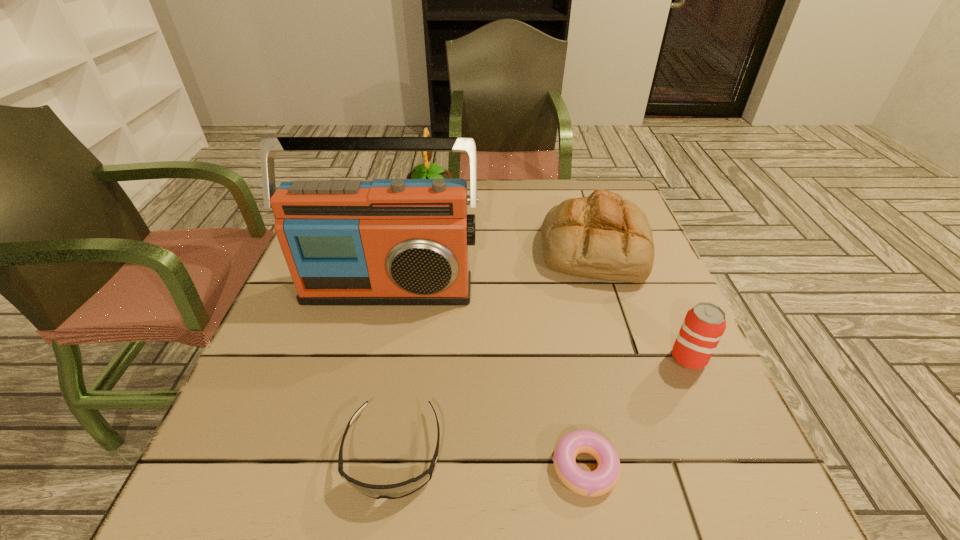
In the image, there is a desktop. At what (x,y) coordinates should I click in order to perform the action: click on vacant space at the far edge. Please return your answer as a coordinate pair (x, y). Looking at the image, I should click on (539, 200).

In the image, there is a desktop. Where is `vacant region at the near edge`? The width and height of the screenshot is (960, 540). vacant region at the near edge is located at coordinates (365, 478).

Identify the location of vacant space at the left edge. (255, 358).

Locate an element on the screen. This screenshot has width=960, height=540. free space at the right edge of the desktop is located at coordinates (675, 397).

Where is `free space between the goggles and the bread`? free space between the goggles and the bread is located at coordinates (494, 350).

Locate an element on the screen. The image size is (960, 540). blank region between the bread and the tallest object is located at coordinates (492, 268).

The height and width of the screenshot is (540, 960). What are the coordinates of `vacant point located between the second shortest object and the doughnut` in the screenshot? It's located at (489, 460).

The image size is (960, 540). Identify the location of vacant area that lies between the shortest object and the sunflower. (507, 330).

Where is `vacant point located between the shortest object and the farthest object`? vacant point located between the shortest object and the farthest object is located at coordinates (507, 330).

The width and height of the screenshot is (960, 540). What are the coordinates of `free area in between the tallest object and the doughnut` in the screenshot? It's located at (486, 378).